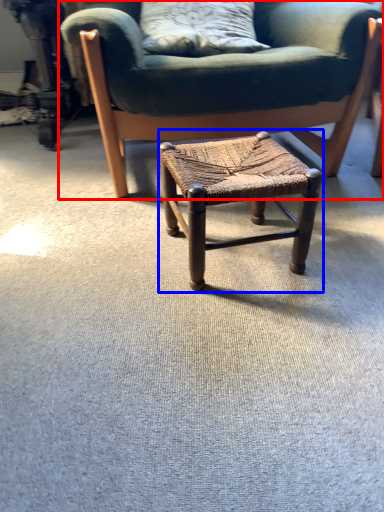
Question: Which point is further to the camera, chair (highlighted by a red box) or stool (highlighted by a blue box)?

Choices:
 (A) chair
 (B) stool

Answer: (A)